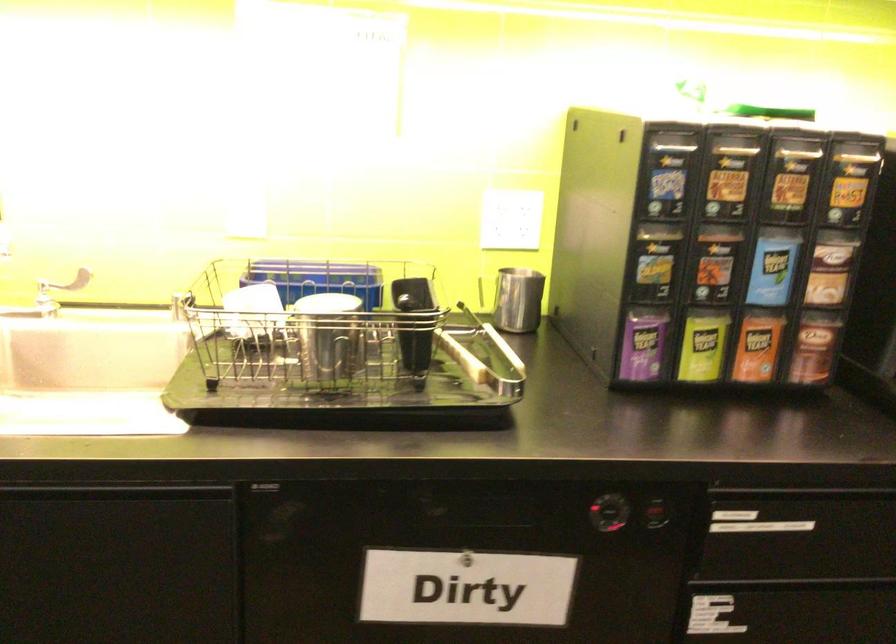
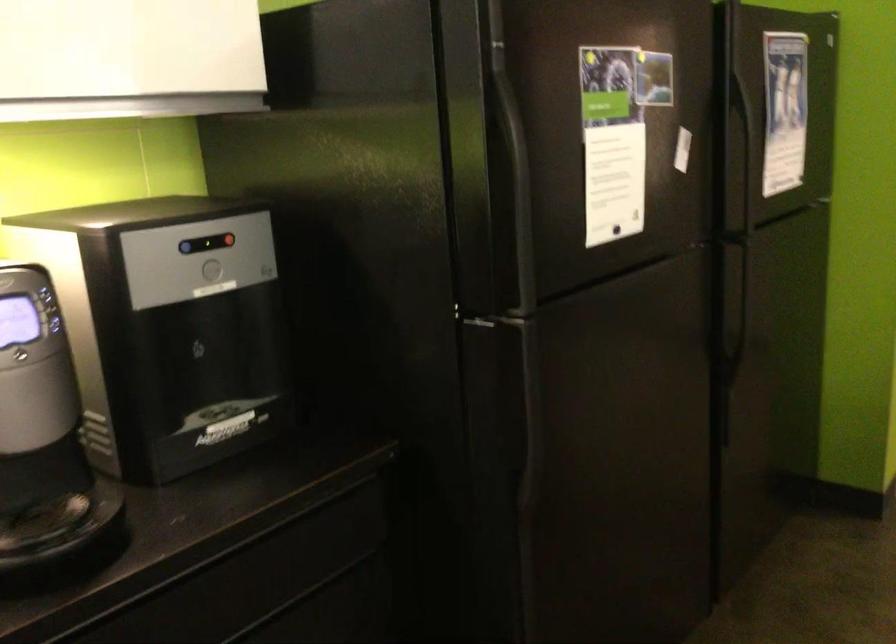
Question: The images are taken continuously from a first-person perspective. In which direction is your viewpoint rotating?

Choices:
 (A) Left
 (B) Right
 (C) Up
 (D) Down

Answer: (B)